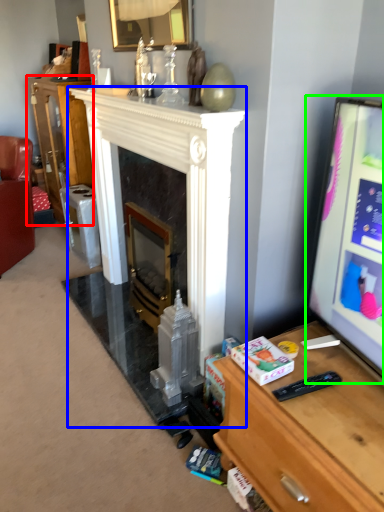
Question: Considering the real-world distances, which object is closest to cabinetry (highlighted by a red box)? fireplace (highlighted by a blue box) or computer monitor (highlighted by a green box).

Choices:
 (A) fireplace
 (B) computer monitor

Answer: (A)